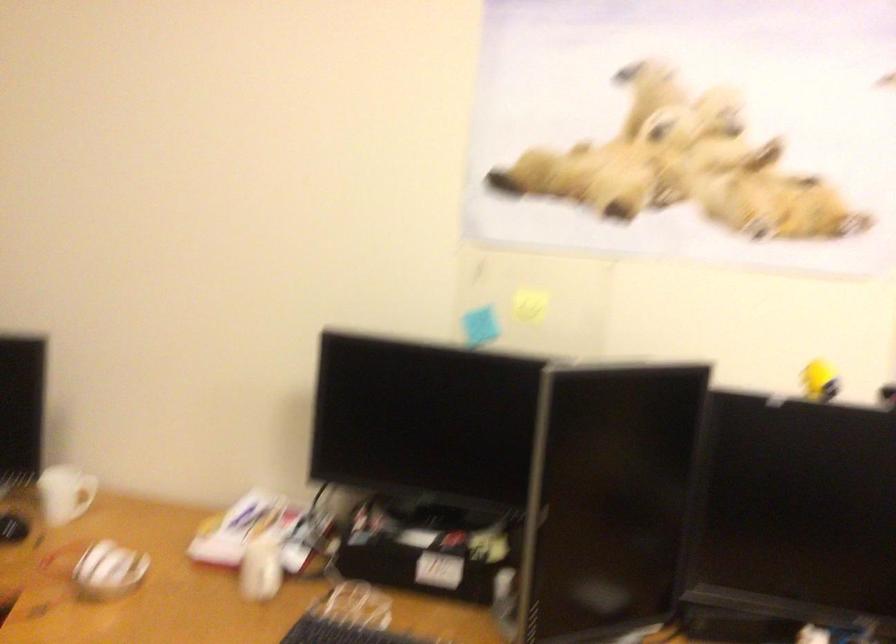
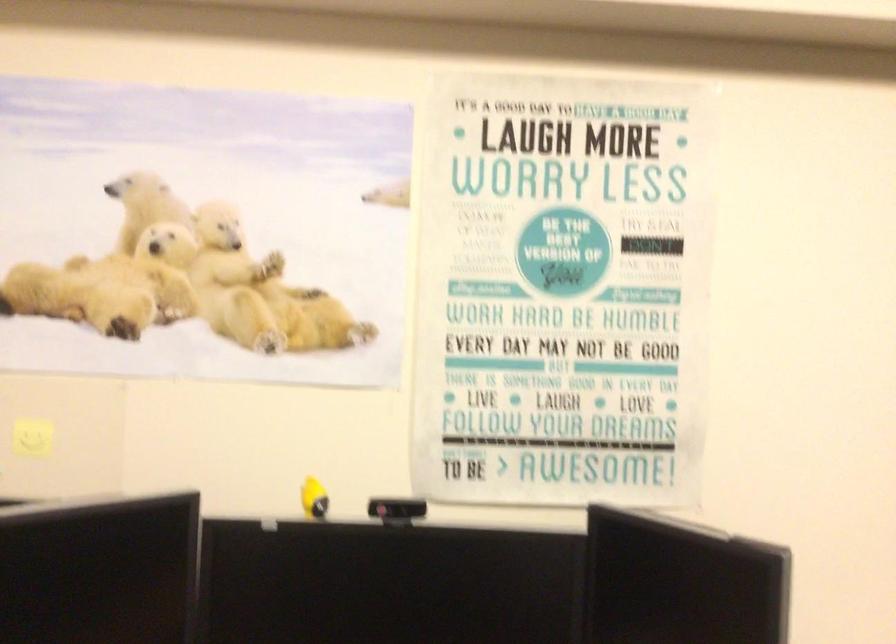
Where in the second image is the point corresponding to the point at 700,80 from the first image?

(201, 187)